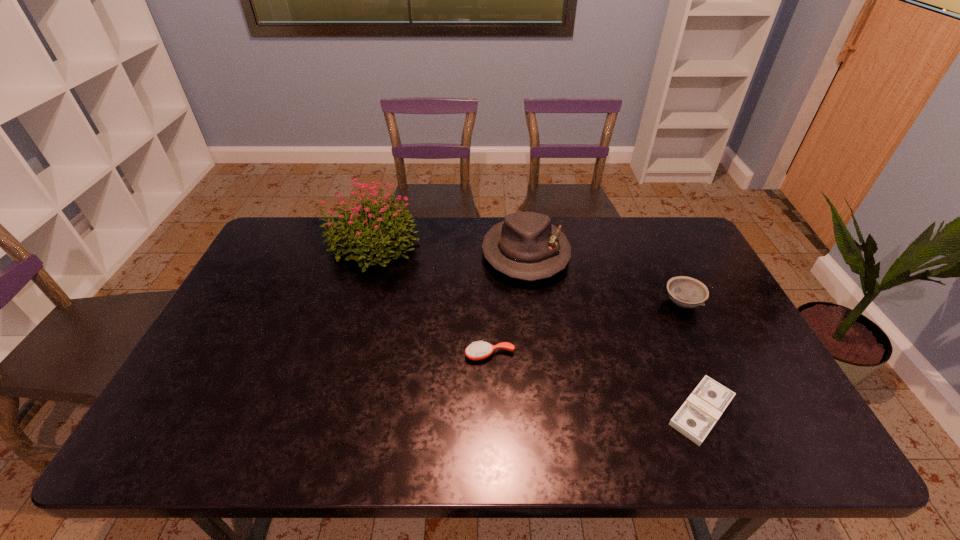
Image resolution: width=960 pixels, height=540 pixels. Find the location of `free point that satisfies the following two spatial constraints: 1. on the decorative side of the fourth shortest object; 2. on the right side of the shortest object`. free point that satisfies the following two spatial constraints: 1. on the decorative side of the fourth shortest object; 2. on the right side of the shortest object is located at coordinates (544, 411).

Locate an element on the screen. The width and height of the screenshot is (960, 540). vacant area that satisfies the following two spatial constraints: 1. on the decorative side of the second tallest object; 2. on the left side of the shortest object is located at coordinates (544, 411).